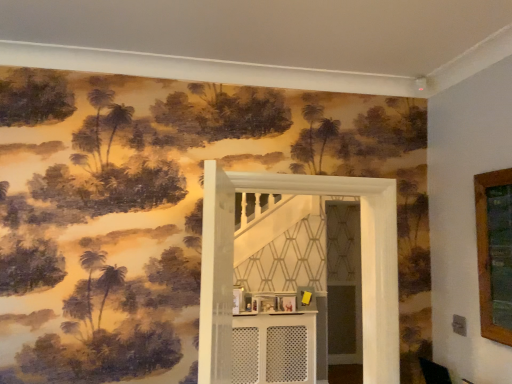
Question: Can you confirm if white textured door at center is taller than white perforated table at center?

Choices:
 (A) yes
 (B) no

Answer: (A)

Question: Would you say white textured door at center contains white perforated table at center?

Choices:
 (A) yes
 (B) no

Answer: (B)

Question: From a real-world perspective, is white textured door at center under white perforated table at center?

Choices:
 (A) yes
 (B) no

Answer: (B)

Question: Does white textured door at center turn towards white perforated table at center?

Choices:
 (A) no
 (B) yes

Answer: (A)

Question: Does white textured door at center have a larger size compared to white perforated table at center?

Choices:
 (A) yes
 (B) no

Answer: (A)

Question: Is white textured door at center next to white perforated table at center and touching it?

Choices:
 (A) yes
 (B) no

Answer: (B)

Question: Is white perforated table at center completely or partially outside of white textured door at center?

Choices:
 (A) yes
 (B) no

Answer: (A)

Question: Is the depth of white perforated table at center less than that of white textured door at center?

Choices:
 (A) yes
 (B) no

Answer: (B)

Question: From the image's perspective, is white perforated table at center beneath white textured door at center?

Choices:
 (A) yes
 (B) no

Answer: (A)

Question: Can you confirm if white perforated table at center is bigger than white textured door at center?

Choices:
 (A) yes
 (B) no

Answer: (B)

Question: Can you confirm if white perforated table at center is shorter than white textured door at center?

Choices:
 (A) no
 (B) yes

Answer: (B)

Question: Is white perforated table at center touching white textured door at center?

Choices:
 (A) yes
 (B) no

Answer: (B)

Question: Looking at the image, does white perforated table at center seem bigger or smaller compared to white textured door at center?

Choices:
 (A) small
 (B) big

Answer: (A)